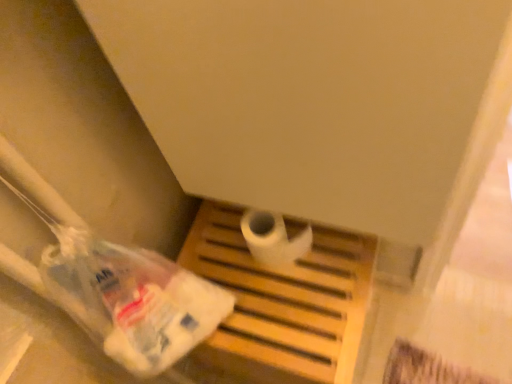
Question: Would you say white matte toilet paper at center is inside or outside wooden tray at center?

Choices:
 (A) inside
 (B) outside

Answer: (B)

Question: From a real-world perspective, is white matte toilet paper at center physically located above or below wooden tray at center?

Choices:
 (A) below
 (B) above

Answer: (B)

Question: Based on their relative distances, which object is farther from the wooden tray at center?

Choices:
 (A) white matte toilet paper at center
 (B) translucent plastic bag at lower left

Answer: (B)

Question: Estimate the real-world distances between objects in this image. Which object is closer to the white matte toilet paper at center?

Choices:
 (A) wooden tray at center
 (B) translucent plastic bag at lower left

Answer: (A)